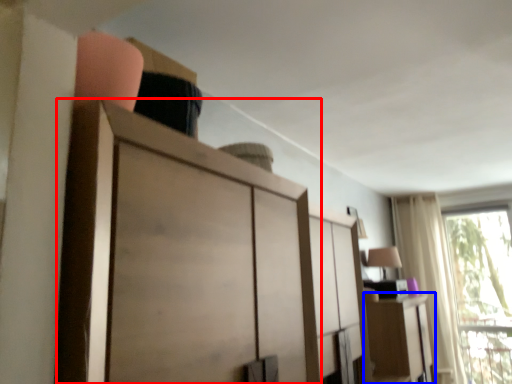
Question: Among these objects, which one is nearest to the camera, cupboard (highlighted by a red box) or cabinetry (highlighted by a blue box)?

Choices:
 (A) cupboard
 (B) cabinetry

Answer: (A)